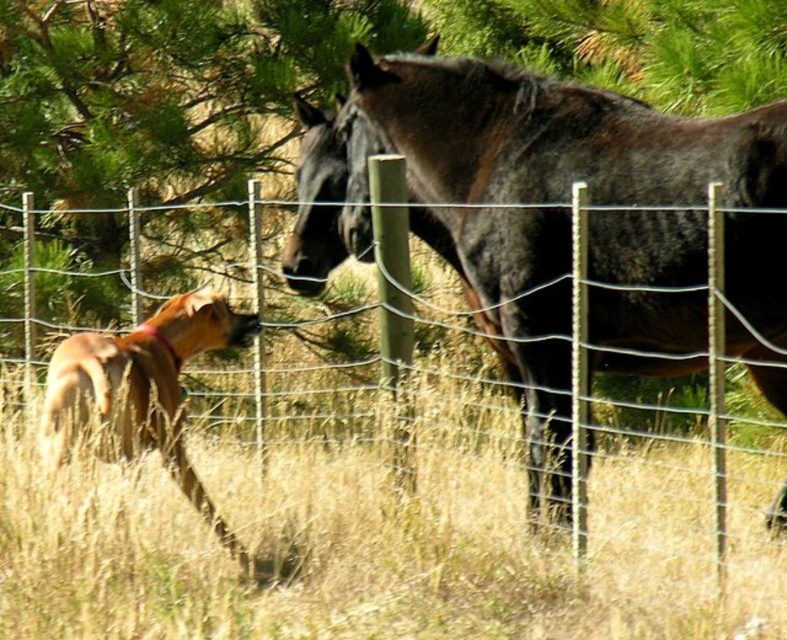
Can you confirm if dry grass at lower left is taller than golden fur dog at lower left?

No, dry grass at lower left is not taller than golden fur dog at lower left.

From the picture: Which is more to the left, dry grass at lower left or golden fur dog at lower left?

golden fur dog at lower left

Consider the image. Who is more forward, (678, 525) or (194, 321)?

Point (194, 321)

Find the location of a particular element. The image size is (787, 640). dry grass at lower left is located at coordinates (379, 547).

Can you confirm if dry grass at lower left is positioned below dark brown glossy horse at center?

Yes.

Describe the element at coordinates (379, 547) in the screenshot. I see `dry grass at lower left` at that location.

The image size is (787, 640). I want to click on dry grass at lower left, so click(x=379, y=547).

Based on the photo, is dark brown glossy horse at center below golden fur dog at lower left?

No, dark brown glossy horse at center is not below golden fur dog at lower left.

What do you see at coordinates (560, 224) in the screenshot?
I see `dark brown glossy horse at center` at bounding box center [560, 224].

You are a GUI agent. You are given a task and a screenshot of the screen. Output one action in this format:
    pyautogui.click(x=<x>, y=<y>)
    Task: Click on the dark brown glossy horse at center
    This screenshot has height=640, width=787.
    Given the screenshot: What is the action you would take?
    pyautogui.click(x=560, y=224)